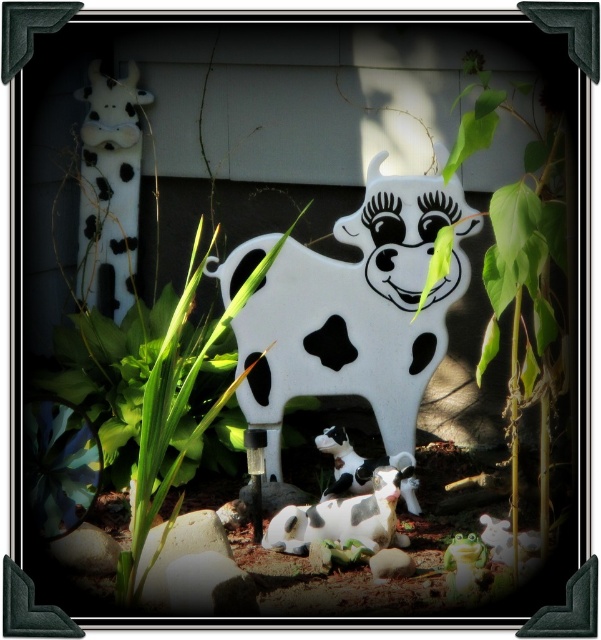
Question: Is white plastic cow at center thinner than green leafy plant at center?

Choices:
 (A) no
 (B) yes

Answer: (A)

Question: Which of the following is the farthest from the observer?

Choices:
 (A) (346, 536)
 (B) (451, 573)

Answer: (A)

Question: Can you confirm if white plastic cow at center is wider than green leafy plant at center?

Choices:
 (A) no
 (B) yes

Answer: (B)

Question: Which object is the farthest from the black and white spotted cow at center?

Choices:
 (A) white plastic cow at center
 (B) polka dot plastic cow at center
 (C) smooth green frog at center
 (D) white matte cow at lower center

Answer: (A)

Question: Considering the real-world distances, which object is closest to the white plastic cow at center?

Choices:
 (A) black and white spotted cow at center
 (B) polka dot plastic cow at center
 (C) smooth green frog at center

Answer: (B)

Question: Is polka dot plastic cow at center positioned behind white matte cow at lower center?

Choices:
 (A) yes
 (B) no

Answer: (A)